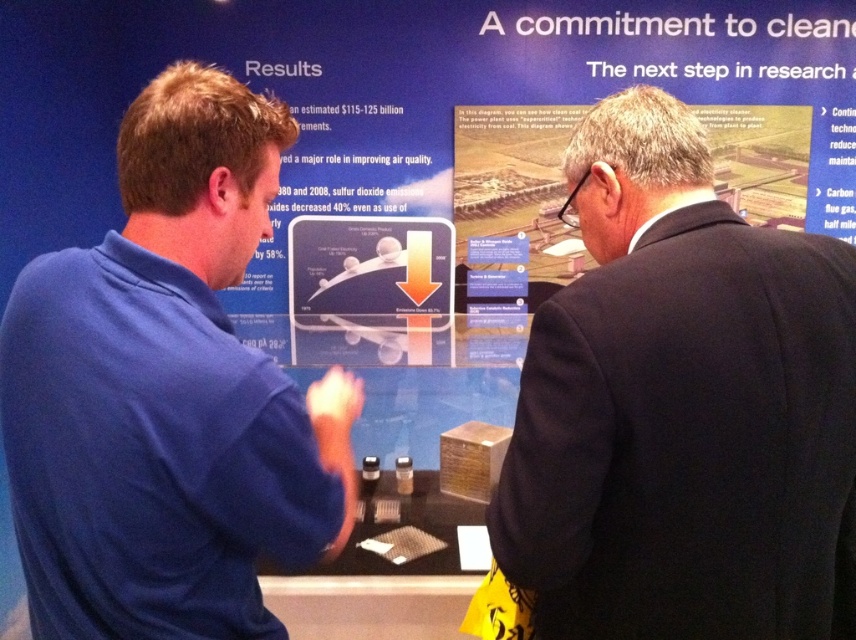
Question: Does black suit at right appear over blue fabric shirt at left?

Choices:
 (A) yes
 (B) no

Answer: (A)

Question: Is the position of black suit at right less distant than that of blue fabric shirt at left?

Choices:
 (A) no
 (B) yes

Answer: (A)

Question: Which of the following is the farthest from the observer?

Choices:
 (A) blue fabric shirt at left
 (B) black suit at right

Answer: (B)

Question: Is black suit at right wider than blue fabric shirt at left?

Choices:
 (A) yes
 (B) no

Answer: (A)

Question: Which object is farther from the camera taking this photo?

Choices:
 (A) black suit at right
 (B) blue fabric shirt at left

Answer: (A)

Question: Which point is closer to the camera?

Choices:
 (A) (571, 157)
 (B) (336, 444)

Answer: (B)